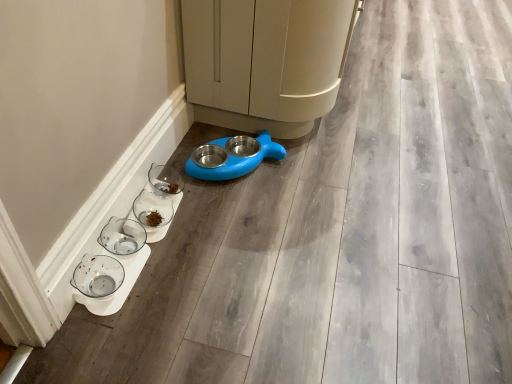
Locate an element on the screen. unoccupied area in front of blue plastic pet feeder at center is located at coordinates (237, 208).